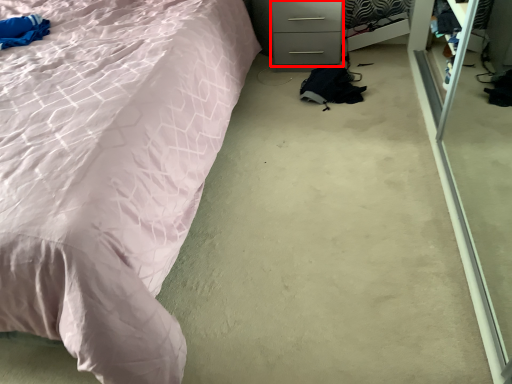
Question: From the image's perspective, where is drawer (annotated by the red box) located in relation to bed in the image?

Choices:
 (A) below
 (B) above

Answer: (B)